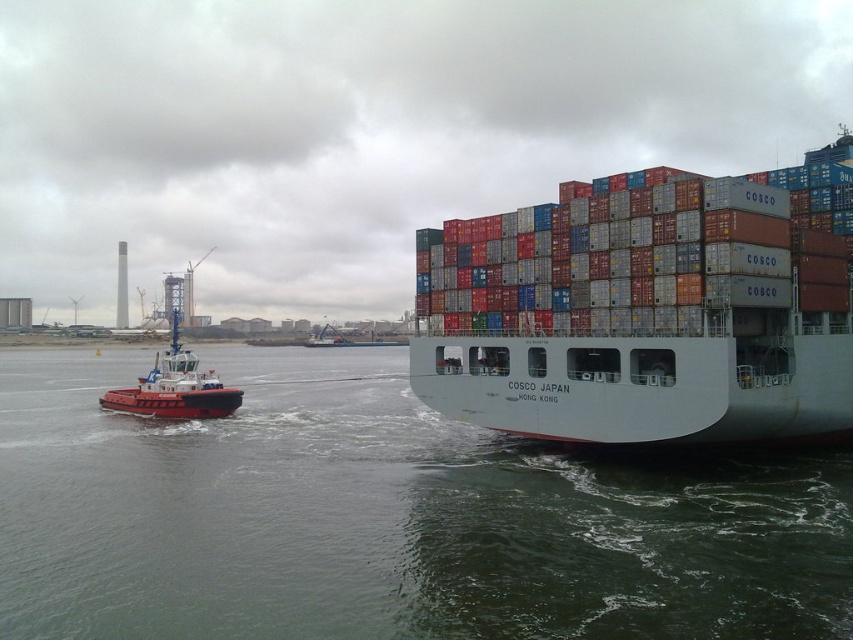
Which is in front, point (648, 237) or point (189, 417)?

Point (648, 237) is in front.

Does point (712, 275) come closer to viewer compared to point (224, 410)?

Yes, point (712, 275) is in front of point (224, 410).

Find the location of a particular element. white matte container ship at center is located at coordinates (x=647, y=308).

Does clear water at lower left have a greater height compared to red matte tugboat at left?

In fact, clear water at lower left may be shorter than red matte tugboat at left.

Which is more to the right, clear water at lower left or red matte tugboat at left?

clear water at lower left is more to the right.

Measure the distance between point (521, 616) and camera.

14.40 meters

This screenshot has height=640, width=853. I want to click on clear water at lower left, so click(386, 518).

Who is higher up, clear water at lower left or white matte container ship at center?

white matte container ship at center

Is clear water at lower left below white matte container ship at center?

Yes.

You are a GUI agent. You are given a task and a screenshot of the screen. Output one action in this format:
    pyautogui.click(x=<x>, y=<y>)
    Task: Click on the clear water at lower left
    
    Given the screenshot: What is the action you would take?
    pyautogui.click(x=386, y=518)

The height and width of the screenshot is (640, 853). Identify the location of clear water at lower left. (386, 518).